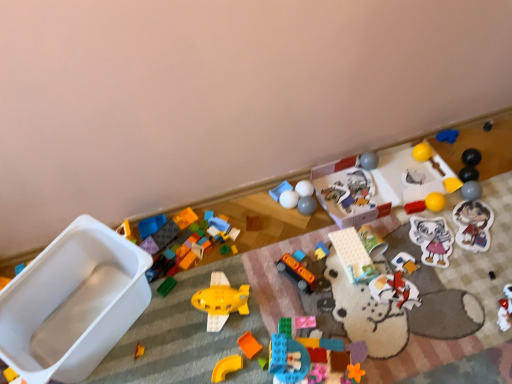
Locate an element on the screen. The width and height of the screenshot is (512, 384). vacant region to the left of white matte figure at center, the nineteenth toy viewed from the left is located at coordinates (343, 285).